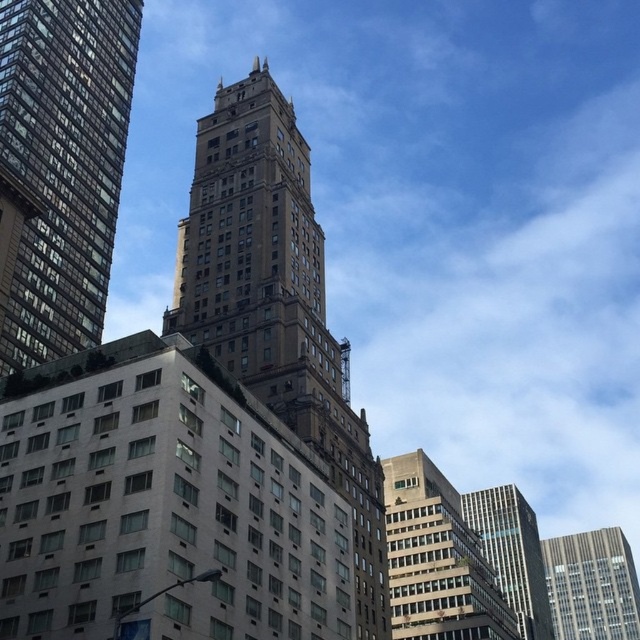
Looking at this image, you are an architect analyzing the urban skyline. Which building is positioned closer to the front of the scene between the brown stone tower at upper left and the gray concrete building at center?

The brown stone tower at upper left is closer to the viewer than the gray concrete building at center.

Based on the provided scene description, where is the brown stone tower at center located in terms of its 2D coordinates?

The brown stone tower at center is located at the 2D coordinates of point (276, 301).